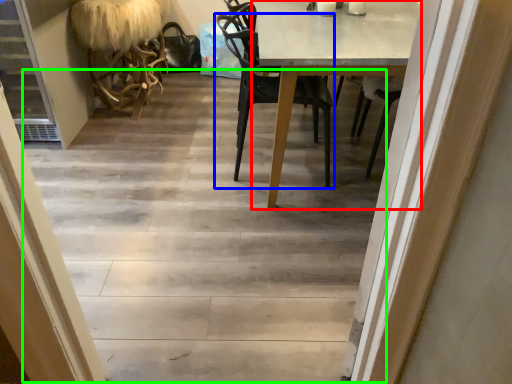
Question: Which object is positioned closest to round table (highlighted by a red box)? Select from chair (highlighted by a blue box) and stairwell (highlighted by a green box).

Choices:
 (A) chair
 (B) stairwell

Answer: (A)